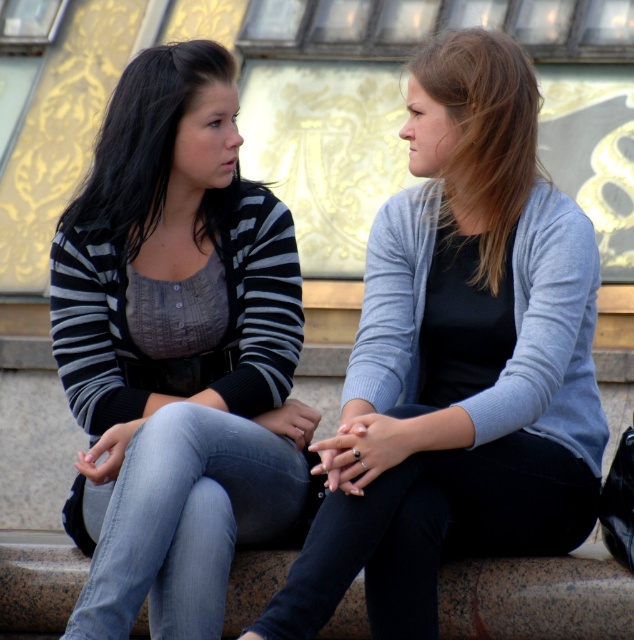
Question: Based on their relative distances, which object is farther from the matte gray cardigan at center?

Choices:
 (A) light blue sweater at center
 (B) matte black sweater at left
 (C) striped knit sweater at left

Answer: (B)

Question: Which of the following is the closest to the observer?

Choices:
 (A) (392, 580)
 (B) (143, 168)

Answer: (A)

Question: Does matte black sweater at left have a larger size compared to matte gray cardigan at center?

Choices:
 (A) yes
 (B) no

Answer: (A)

Question: Which point is closer to the camera?

Choices:
 (A) matte gray cardigan at center
 (B) striped knit sweater at left
 (C) light blue sweater at center
 (D) matte black sweater at left

Answer: (D)

Question: In this image, where is light blue sweater at center located relative to striped knit sweater at left?

Choices:
 (A) above
 (B) below

Answer: (B)

Question: Observing the image, what is the correct spatial positioning of light blue sweater at center in reference to striped knit sweater at left?

Choices:
 (A) left
 (B) right

Answer: (B)